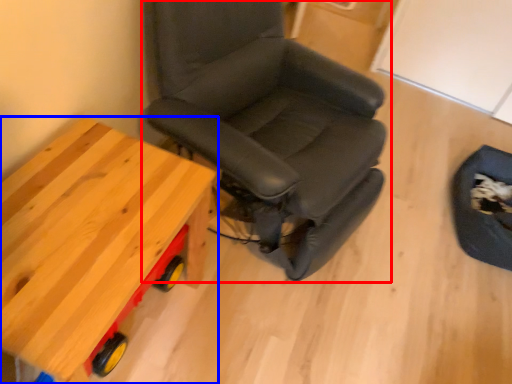
Question: Which object is closer to the camera taking this photo, chair (highlighted by a red box) or table (highlighted by a blue box)?

Choices:
 (A) chair
 (B) table

Answer: (A)